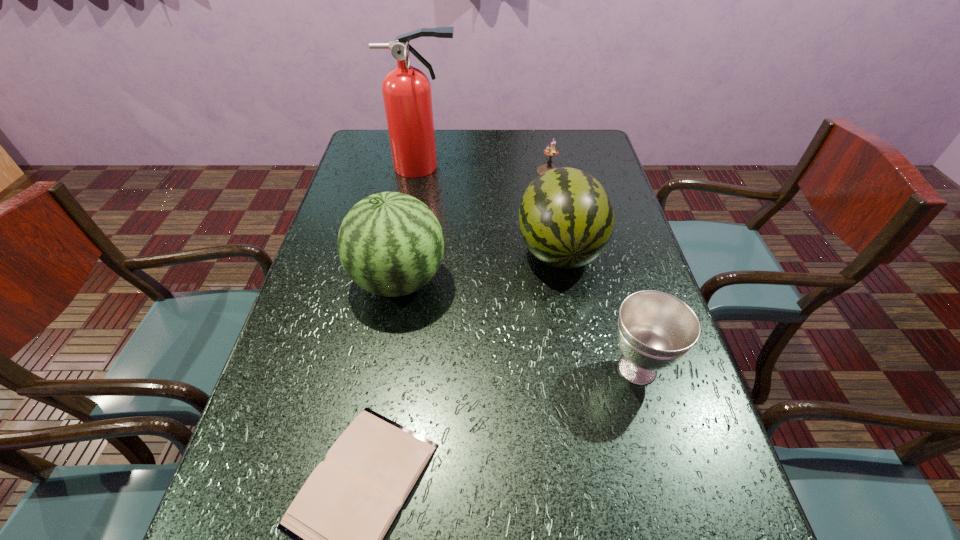
Find the location of a particular element. free space between the candle holder and the fire extinguisher is located at coordinates (486, 169).

Locate an element on the screen. The image size is (960, 540). unoccupied area between the second tallest object and the fourth tallest object is located at coordinates (518, 325).

Locate an element on the screen. The width and height of the screenshot is (960, 540). object that is the third closest to the chalice is located at coordinates coord(390,244).

Locate an element on the screen. The height and width of the screenshot is (540, 960). the fourth closest object to the candle holder is located at coordinates (655, 329).

Where is `vacant space that satisfies the following two spatial constraints: 1. on the front side of the third shortest object; 2. on the right side of the taller watermelon`? vacant space that satisfies the following two spatial constraints: 1. on the front side of the third shortest object; 2. on the right side of the taller watermelon is located at coordinates (383, 369).

At what (x,y) coordinates should I click in order to perform the action: click on vacant region that satisfies the following two spatial constraints: 1. on the back side of the fifth tallest object; 2. on the right side of the left watermelon. Please return your answer as a coordinate pair (x, y). Looking at the image, I should click on (418, 171).

The width and height of the screenshot is (960, 540). I want to click on vacant space that satisfies the following two spatial constraints: 1. on the front side of the fire extinguisher; 2. on the left side of the candle holder, so click(423, 171).

At what (x,y) coordinates should I click in order to perform the action: click on free spot that satisfies the following two spatial constraints: 1. at the stem end of the shorter watermelon; 2. on the left side of the second nearest object. Please return your answer as a coordinate pair (x, y). Looking at the image, I should click on (582, 369).